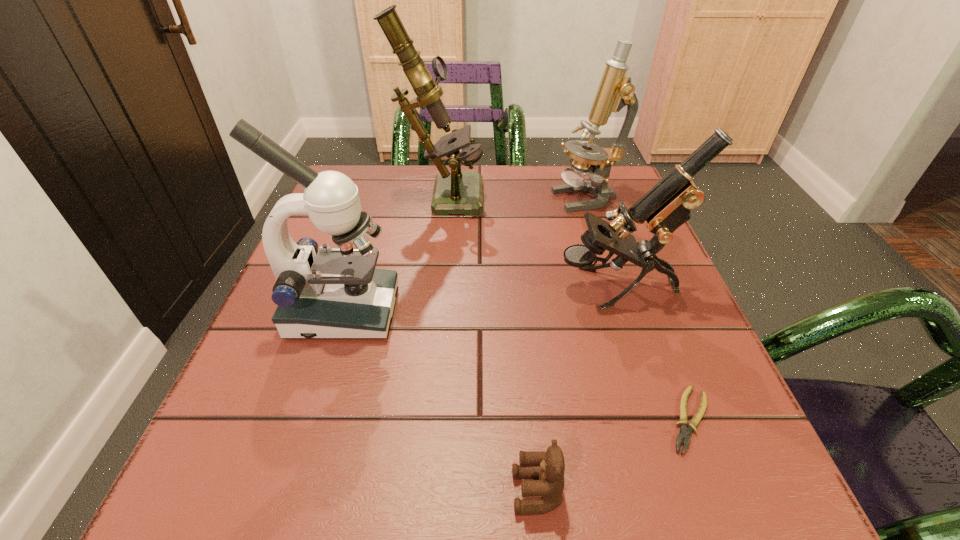
Where is `object at the left edge`? object at the left edge is located at coordinates (335, 293).

You are a GUI agent. You are given a task and a screenshot of the screen. Output one action in this format:
    pyautogui.click(x=<x>, y=<y>)
    Task: Click on the pliers present at the right edge
    This screenshot has width=960, height=540.
    Given the screenshot: What is the action you would take?
    pyautogui.click(x=684, y=433)

Where is `object positioned at the far right corner`? The image size is (960, 540). object positioned at the far right corner is located at coordinates (615, 91).

I want to click on object that is at the near right corner, so click(x=684, y=433).

Locate an element on the screen. Image resolution: width=960 pixels, height=540 pixels. free region at the far edge of the desktop is located at coordinates (498, 181).

Where is `vacant space at the near edge`? The height and width of the screenshot is (540, 960). vacant space at the near edge is located at coordinates (569, 460).

This screenshot has height=540, width=960. In order to click on free spot at the left edge of the desktop in this screenshot , I will do `click(332, 414)`.

Identify the location of vacant space at the right edge. (663, 345).

At what (x,y) coordinates should I click in order to perform the action: click on vacant area at the near left corner. Please return your answer as a coordinate pair (x, y). The image size is (960, 540). Looking at the image, I should click on (292, 458).

In the image, there is a desktop. Find the location of `vacant space at the far right corner`. vacant space at the far right corner is located at coordinates (614, 198).